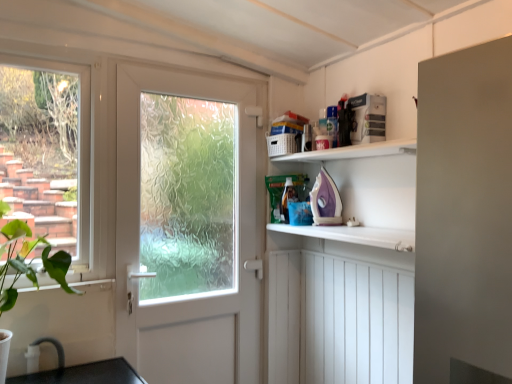
Question: Is clear glass window at left facing away from green leafy plant at lower left?

Choices:
 (A) yes
 (B) no

Answer: (B)

Question: Is clear glass window at left thinner than green leafy plant at lower left?

Choices:
 (A) yes
 (B) no

Answer: (A)

Question: Can you confirm if clear glass window at left is wider than green leafy plant at lower left?

Choices:
 (A) yes
 (B) no

Answer: (B)

Question: Can green leafy plant at lower left be found inside clear glass window at left?

Choices:
 (A) yes
 (B) no

Answer: (B)

Question: From a real-world perspective, is clear glass window at left on top of green leafy plant at lower left?

Choices:
 (A) no
 (B) yes

Answer: (B)

Question: Is point tap(34, 253) closer or farther from the camera than point tap(247, 380)?

Choices:
 (A) closer
 (B) farther

Answer: (A)

Question: From the image's perspective, is clear glass window at left positioned above or below white frosted glass door at center?

Choices:
 (A) below
 (B) above

Answer: (B)

Question: From a real-world perspective, relative to white frosted glass door at center, is clear glass window at left vertically above or below?

Choices:
 (A) below
 (B) above

Answer: (B)

Question: Is clear glass window at left in front of or behind white frosted glass door at center in the image?

Choices:
 (A) behind
 (B) front

Answer: (B)

Question: In terms of height, does white frosted glass door at center look taller or shorter compared to green leafy plant at lower left?

Choices:
 (A) tall
 (B) short

Answer: (A)

Question: Is white frosted glass door at center wider or thinner than green leafy plant at lower left?

Choices:
 (A) wide
 (B) thin

Answer: (B)

Question: Based on their positions, is white frosted glass door at center located to the left or right of green leafy plant at lower left?

Choices:
 (A) right
 (B) left

Answer: (A)

Question: Does point (135, 221) appear closer or farther from the camera than point (8, 309)?

Choices:
 (A) closer
 (B) farther

Answer: (B)

Question: From the image's perspective, is green leafy plant at lower left located above or below white frosted glass door at center?

Choices:
 (A) below
 (B) above

Answer: (A)

Question: Is green leafy plant at lower left to the left or to the right of white frosted glass door at center in the image?

Choices:
 (A) right
 (B) left

Answer: (B)